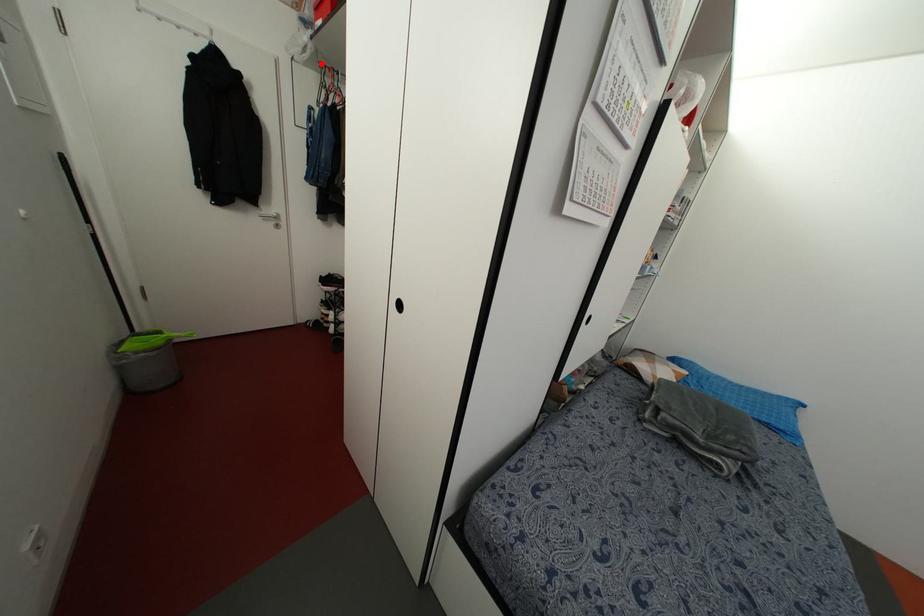
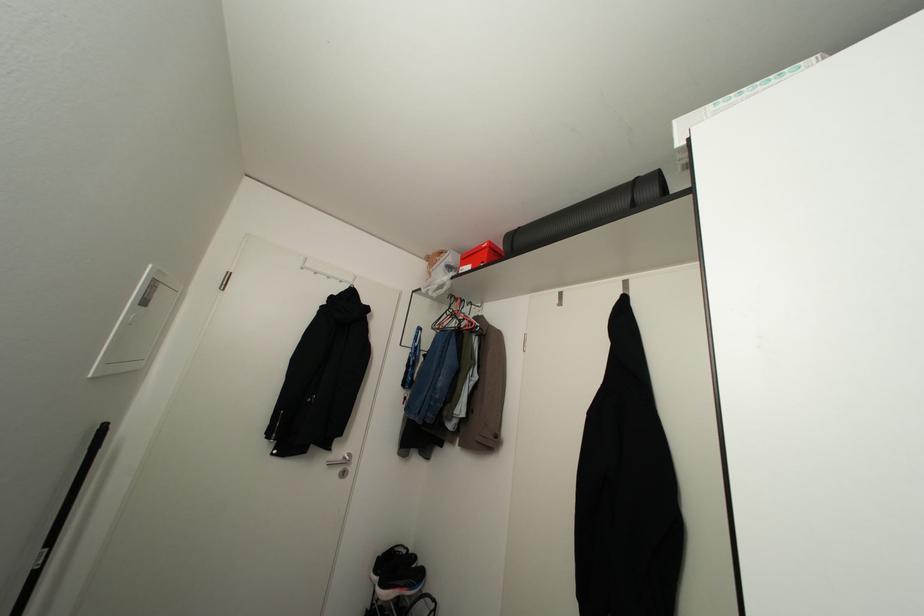
Locate, in the second image, the point that corresponds to the highlighted location in the first image.

(451, 294)